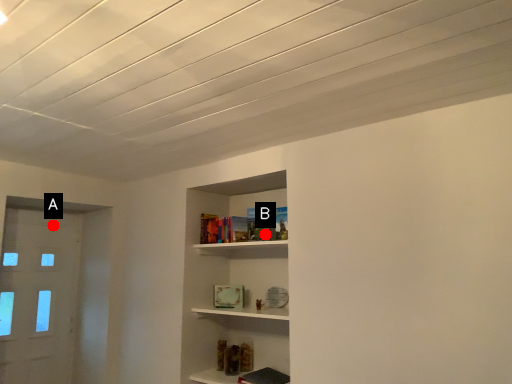
Question: Two points are circled on the image, labeled by A and B beside each circle. Which of the following is the farthest from the observer?

Choices:
 (A) A is further
 (B) B is further

Answer: (A)